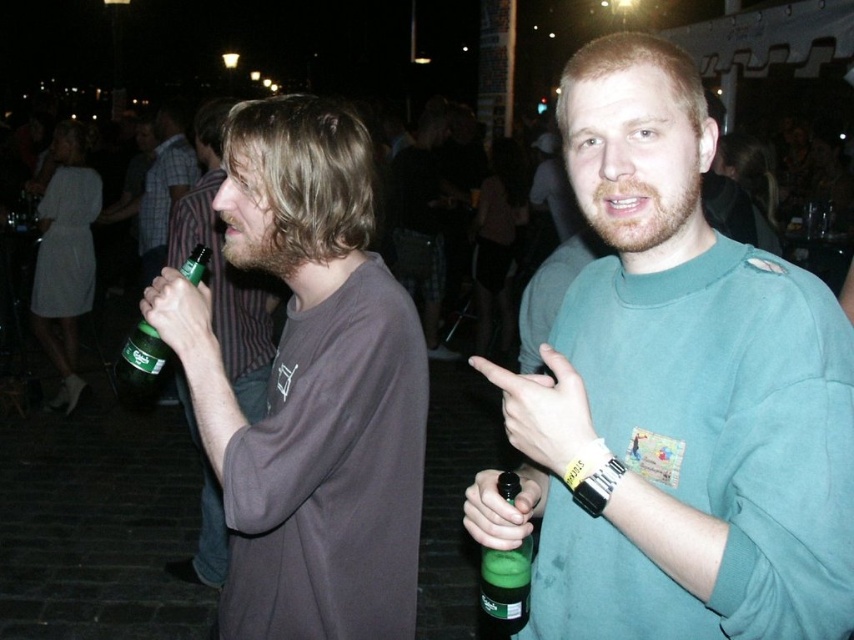
Between green matte shirt at center and matte brown shirt at center, which one appears on the right side from the viewer's perspective?

From the viewer's perspective, green matte shirt at center appears more on the right side.

The height and width of the screenshot is (640, 854). What do you see at coordinates (676, 396) in the screenshot? I see `green matte shirt at center` at bounding box center [676, 396].

In order to click on green matte shirt at center in this screenshot , I will do pyautogui.click(x=676, y=396).

Who is more forward, (764, 369) or (126, 381)?

Point (764, 369) is more forward.

Who is more distant from viewer, (653, 317) or (121, 396)?

The point (121, 396) is behind.

Which is behind, point (718, 637) or point (139, 392)?

The point (139, 392) is more distant.

Identify the location of green matte shirt at center. The height and width of the screenshot is (640, 854). (676, 396).

Is matte brown shirt at center taller than green matte bottle at center?

Indeed, matte brown shirt at center has a greater height compared to green matte bottle at center.

Which of these two, matte brown shirt at center or green matte bottle at center, stands taller?

matte brown shirt at center

Which is behind, point (164, 125) or point (528, 593)?

The point (164, 125) is more distant.

This screenshot has height=640, width=854. I want to click on matte brown shirt at center, so click(x=162, y=188).